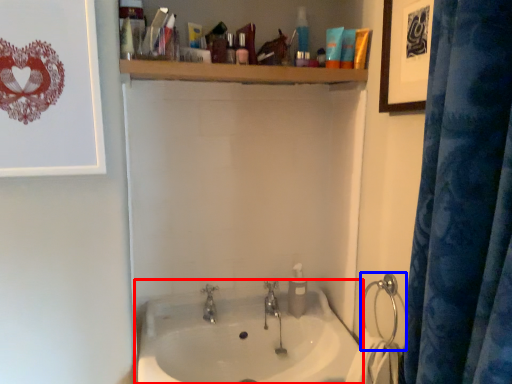
Question: Which object appears farthest to the camera in this image, sink (highlighted by a red box) or shower (highlighted by a blue box)?

Choices:
 (A) sink
 (B) shower

Answer: (B)